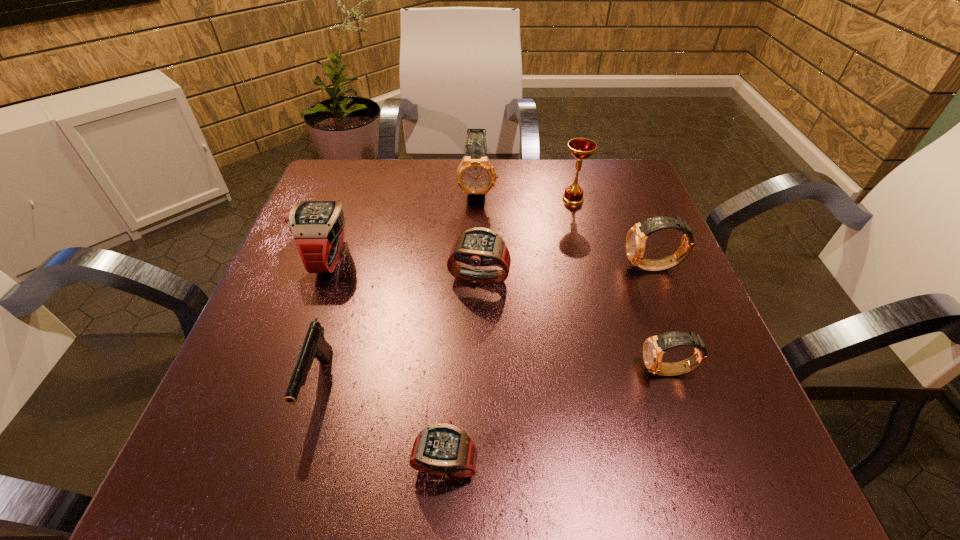
At what (x,y) coordinates should I click in order to perform the action: click on object situated at the far right corner. Please return your answer as a coordinate pair (x, y). This screenshot has width=960, height=540. Looking at the image, I should click on (581, 148).

In the image, there is a desktop. Where is `free region at the far edge`? This screenshot has width=960, height=540. free region at the far edge is located at coordinates (423, 194).

At what (x,y) coordinates should I click in order to perform the action: click on vacant region at the left edge of the desktop. Please return your answer as a coordinate pair (x, y). This screenshot has height=540, width=960. Looking at the image, I should click on (277, 377).

You are a GUI agent. You are given a task and a screenshot of the screen. Output one action in this format:
    pyautogui.click(x=<x>, y=<y>)
    Task: Click on the vacant space at the far left corner of the desktop
    The image size is (960, 540).
    Given the screenshot: What is the action you would take?
    pyautogui.click(x=333, y=163)

In the image, there is a desktop. Where is `free region at the near left corner`? free region at the near left corner is located at coordinates (271, 436).

Find the location of a particular element. vacant area at the far right corner is located at coordinates (605, 203).

The height and width of the screenshot is (540, 960). Identify the location of free spot at the near right corner of the desktop. (718, 467).

The height and width of the screenshot is (540, 960). I want to click on free space between the sixth object from left to right and the shortest object, so click(509, 332).

At what (x,y) coordinates should I click in order to perform the action: click on free area in between the smallest red watch and the black pistol. Please return your answer as a coordinate pair (x, y). The width and height of the screenshot is (960, 540). Looking at the image, I should click on (382, 425).

Find the location of a particular element. This screenshot has width=960, height=540. empty location between the leftmost watch and the smallest gold watch is located at coordinates (498, 315).